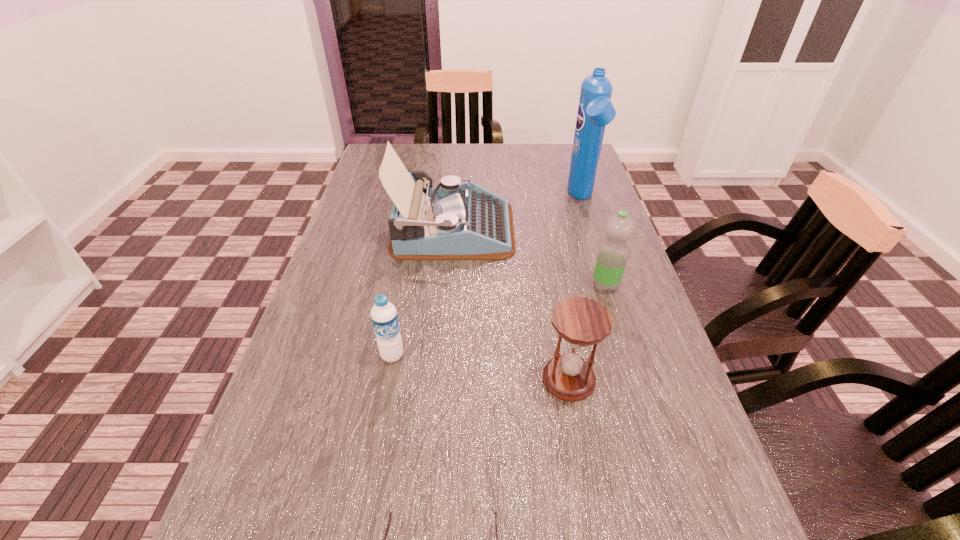
The width and height of the screenshot is (960, 540). I want to click on vacant area situated 0.070m on the front of the third object from right to left, so click(579, 438).

I want to click on vacant space located 0.060m on the label of the shorter water bottle, so click(x=386, y=392).

What are the coordinates of `object present at the left edge` in the screenshot? It's located at (454, 221).

This screenshot has width=960, height=540. Identify the location of shampoo at the right edge. (595, 110).

Image resolution: width=960 pixels, height=540 pixels. I want to click on water bottle that is at the right edge, so click(x=612, y=256).

The height and width of the screenshot is (540, 960). In order to click on hourglass at the right edge in this screenshot , I will do `click(581, 321)`.

This screenshot has width=960, height=540. In order to click on vacant area at the far edge in this screenshot , I will do `click(451, 174)`.

Identify the location of blank space at the left edge. (306, 500).

Locate an element on the screen. This screenshot has width=960, height=540. free spot at the right edge of the desktop is located at coordinates (662, 357).

The height and width of the screenshot is (540, 960). What are the coordinates of `vacant space at the far left corner` in the screenshot? It's located at (366, 171).